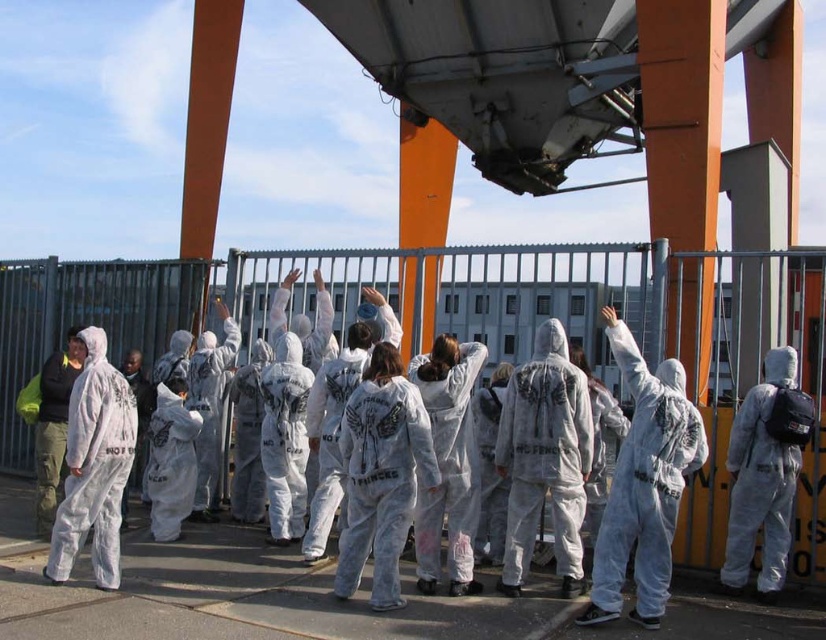
Does white matte jumpsuit at center appear under dark green fabric jacket at left?

Yes.

Is white matte jumpsuit at center positioned behind dark green fabric jacket at left?

No, it is in front of dark green fabric jacket at left.

Which is behind, point (540, 502) or point (39, 472)?

Positioned behind is point (39, 472).

Locate an element on the screen. The image size is (826, 640). white matte jumpsuit at center is located at coordinates (544, 458).

Which is below, white matte jumpsuit at center or white matte hazmat suit at right?

Positioned lower is white matte hazmat suit at right.

Can you confirm if white matte jumpsuit at center is shorter than white matte hazmat suit at right?

In fact, white matte jumpsuit at center may be taller than white matte hazmat suit at right.

Between point (547, 355) and point (763, 506), which one is positioned in front?

Positioned in front is point (763, 506).

Where is `white matte jumpsuit at center`? white matte jumpsuit at center is located at coordinates pos(544,458).

Can you confirm if white matte hazmat suit at right is smaller than dark green fabric jacket at left?

Indeed, white matte hazmat suit at right has a smaller size compared to dark green fabric jacket at left.

Which of these two, white matte hazmat suit at right or dark green fabric jacket at left, stands taller?

With more height is white matte hazmat suit at right.

Does point (748, 497) come closer to viewer compared to point (77, 326)?

Yes, point (748, 497) is closer to viewer.

You are a GUI agent. You are given a task and a screenshot of the screen. Output one action in this format:
    pyautogui.click(x=<x>, y=<y>)
    Task: Click on the white matte hazmat suit at right
    
    Given the screenshot: What is the action you would take?
    click(x=765, y=472)